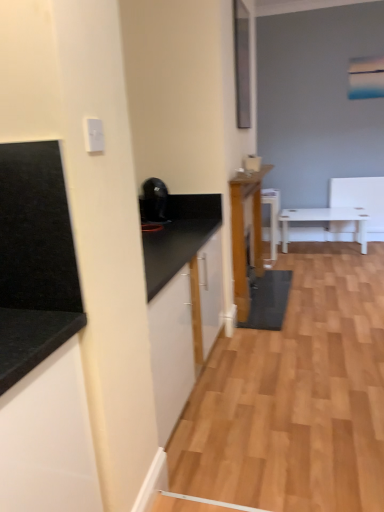
Question: Is wooden cabinet at center, acting as the second cabinetry starting from the left, thinner than black granite countertop at left, which is the second cabinetry in right-to-left order?

Choices:
 (A) no
 (B) yes

Answer: (B)

Question: Does wooden cabinet at center, placed as the 2th cabinetry when sorted from front to back, come behind black granite countertop at left, which is the second cabinetry in right-to-left order?

Choices:
 (A) no
 (B) yes

Answer: (B)

Question: Is wooden cabinet at center, acting as the second cabinetry starting from the left, aimed at black granite countertop at left, which ranks as the first cabinetry in front-to-back order?

Choices:
 (A) yes
 (B) no

Answer: (B)

Question: Considering the relative sizes of wooden cabinet at center, acting as the second cabinetry starting from the left, and black granite countertop at left, which is the second cabinetry in right-to-left order, in the image provided, is wooden cabinet at center, acting as the second cabinetry starting from the left, wider than black granite countertop at left, which is the second cabinetry in right-to-left order,?

Choices:
 (A) no
 (B) yes

Answer: (A)

Question: From a real-world perspective, is wooden cabinet at center, acting as the second cabinetry starting from the left, on top of black granite countertop at left, which is counted as the 2th cabinetry, starting from the back?

Choices:
 (A) no
 (B) yes

Answer: (A)

Question: In the image, is black granite countertop at left, placed as the second countertop when sorted from back to front, positioned in front of or behind black granite countertop at left, which is counted as the 2th cabinetry, starting from the back?

Choices:
 (A) front
 (B) behind

Answer: (B)

Question: From a real-world perspective, relative to black granite countertop at left, which is the second cabinetry in right-to-left order, is black granite countertop at left, placed as the second countertop when sorted from back to front, vertically above or below?

Choices:
 (A) above
 (B) below

Answer: (A)

Question: Based on their positions, is black granite countertop at left, the first countertop in the front-to-back sequence, located to the left or right of black granite countertop at left, which is the 1th cabinetry in left-to-right order?

Choices:
 (A) right
 (B) left

Answer: (A)

Question: From the image's perspective, is black granite countertop at left, placed as the second countertop when sorted from back to front, positioned above or below black granite countertop at left, which is the second cabinetry in right-to-left order?

Choices:
 (A) below
 (B) above

Answer: (B)

Question: Is black granite countertop at left, which appears as the first countertop when viewed from the back, in front of or behind black granite countertop at left, which is the second cabinetry in right-to-left order, in the image?

Choices:
 (A) behind
 (B) front

Answer: (A)

Question: In terms of width, does black granite countertop at left, which appears as the first countertop when viewed from the back, look wider or thinner when compared to black granite countertop at left, which ranks as the first cabinetry in front-to-back order?

Choices:
 (A) wide
 (B) thin

Answer: (A)

Question: Considering the positions of black granite countertop at left, which appears as the first countertop when viewed from the back, and black granite countertop at left, which is the 1th cabinetry in left-to-right order, in the image, is black granite countertop at left, which appears as the first countertop when viewed from the back, bigger or smaller than black granite countertop at left, which is the 1th cabinetry in left-to-right order,?

Choices:
 (A) big
 (B) small

Answer: (A)

Question: From the image's perspective, relative to black granite countertop at left, which is counted as the 2th cabinetry, starting from the back, is black granite countertop at left, which appears as the second countertop when viewed from the front, above or below?

Choices:
 (A) above
 (B) below

Answer: (A)

Question: In the image, is black granite countertop at left, which appears as the first countertop when viewed from the back, on the left side or the right side of black glossy coffee maker at upper center?

Choices:
 (A) left
 (B) right

Answer: (B)

Question: Is black granite countertop at left, which appears as the first countertop when viewed from the back, inside or outside of black glossy coffee maker at upper center?

Choices:
 (A) inside
 (B) outside

Answer: (B)